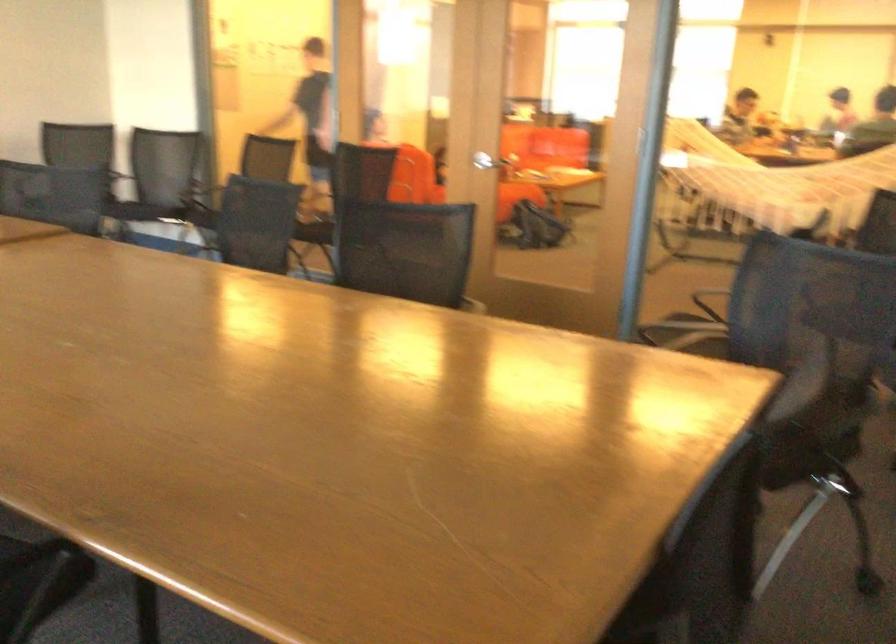
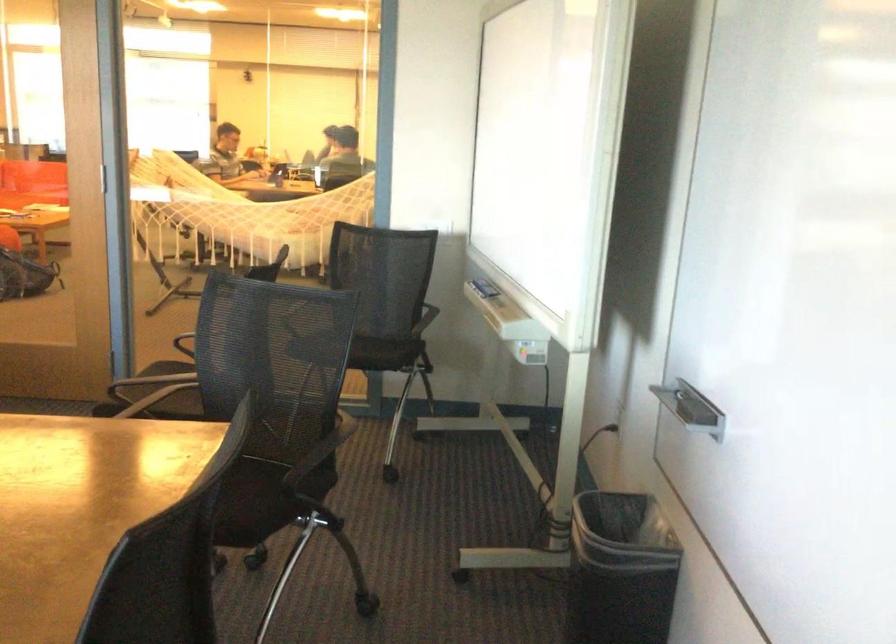
Question: I am providing you with two images of the same scene from different viewpoints. Which of the following objects are not visible in image2?

Choices:
 (A) white memo pad
 (B) white net hammock
 (C) chair armrest
 (D) black backpack

Answer: (B)